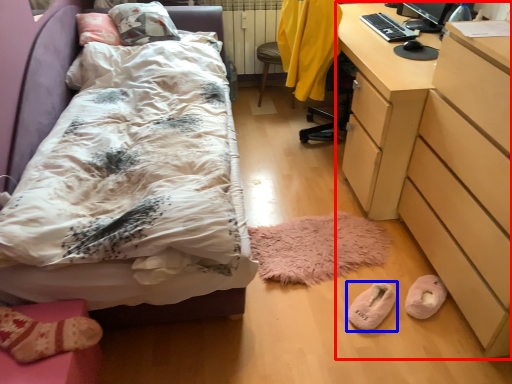
Question: Which point is closer to the camera, desk (highlighted by a red box) or footwear (highlighted by a blue box)?

Choices:
 (A) desk
 (B) footwear

Answer: (A)